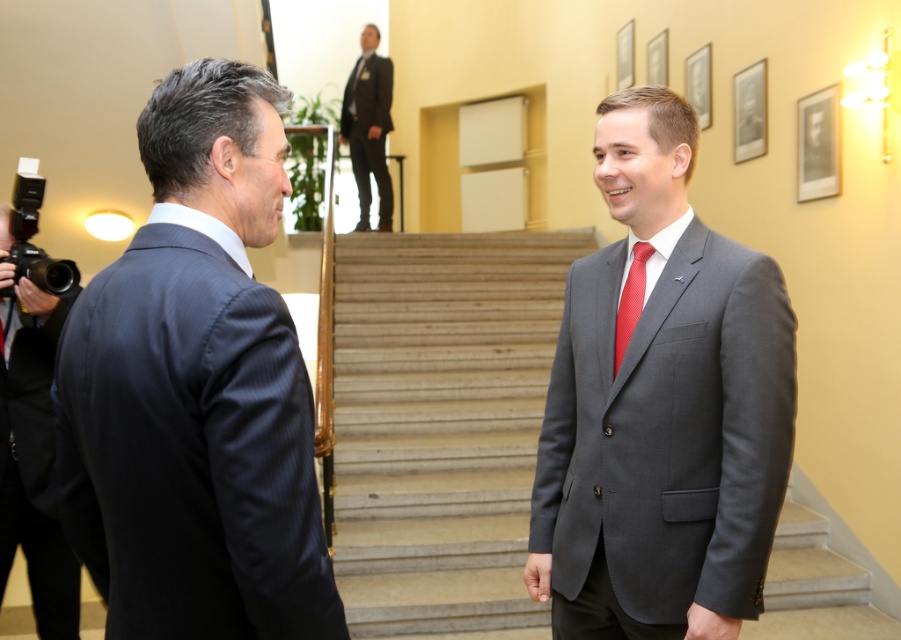
Question: Which object is farther from the camera taking this photo?

Choices:
 (A) red silk tie at center
 (B) dark blue suit at left
 (C) smooth stone stairs at center
 (D) matte black suit at left

Answer: (C)

Question: Which of the following is the closest to the observer?

Choices:
 (A) red silk tie at center
 (B) dark gray wool suit at upper center
 (C) matte gray suit at center
 (D) matte black suit at left

Answer: (C)

Question: Can you confirm if dark blue suit at left is thinner than dark gray wool suit at upper center?

Choices:
 (A) yes
 (B) no

Answer: (A)

Question: Can you confirm if matte black suit at left is bigger than red silk tie at center?

Choices:
 (A) no
 (B) yes

Answer: (B)

Question: Is dark blue suit at left above smooth stone stairs at center?

Choices:
 (A) yes
 (B) no

Answer: (A)

Question: Which point appears farthest from the camera in this image?

Choices:
 (A) (569, 442)
 (B) (0, 538)
 (C) (363, 61)
 (D) (512, 442)

Answer: (C)